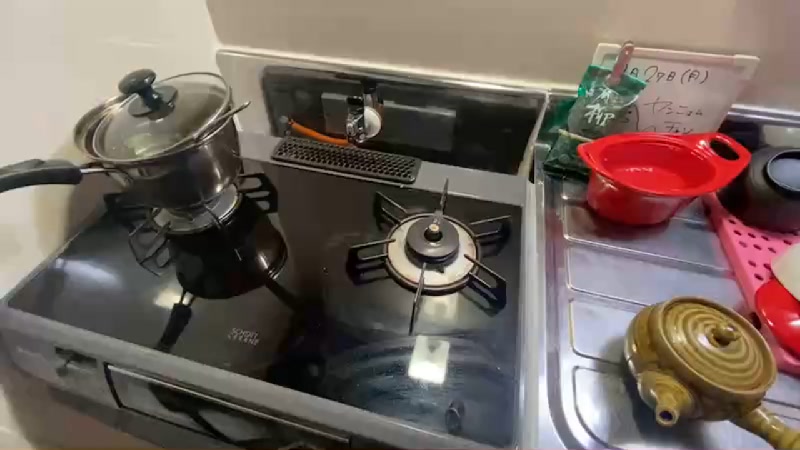
Identify the location of top of stove. (285, 275).